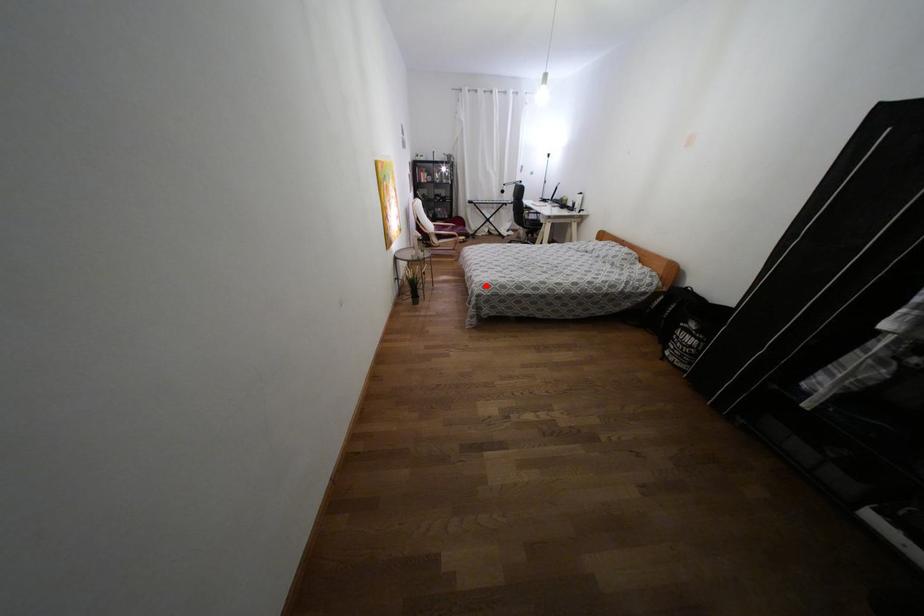
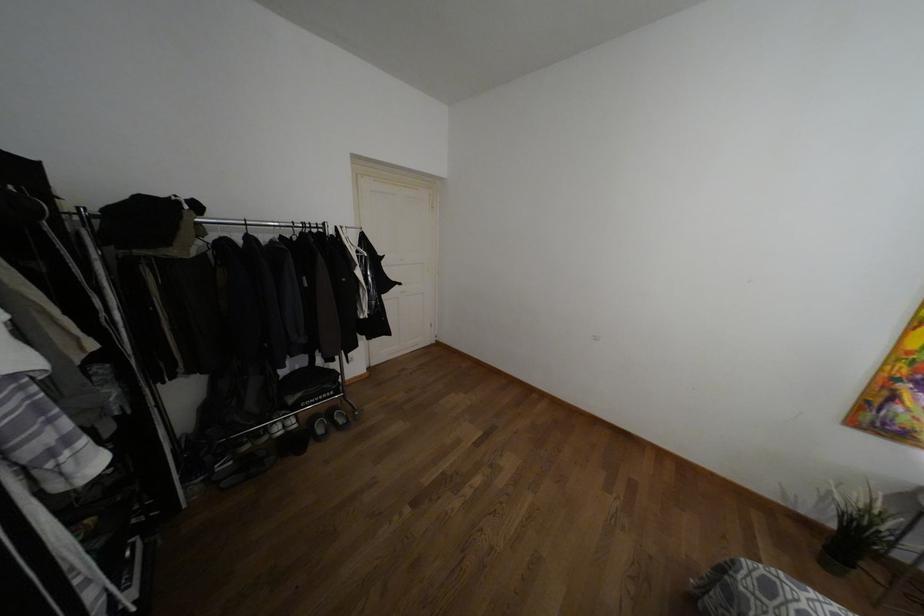
Question: A red point is marked in image1. In image2, is the corresponding 3D point closer to the camera or farther? Reply with the corresponding letter.

Choices:
 (A) The corresponding 3D point is closer.
 (B) The corresponding 3D point is farther.

Answer: (B)